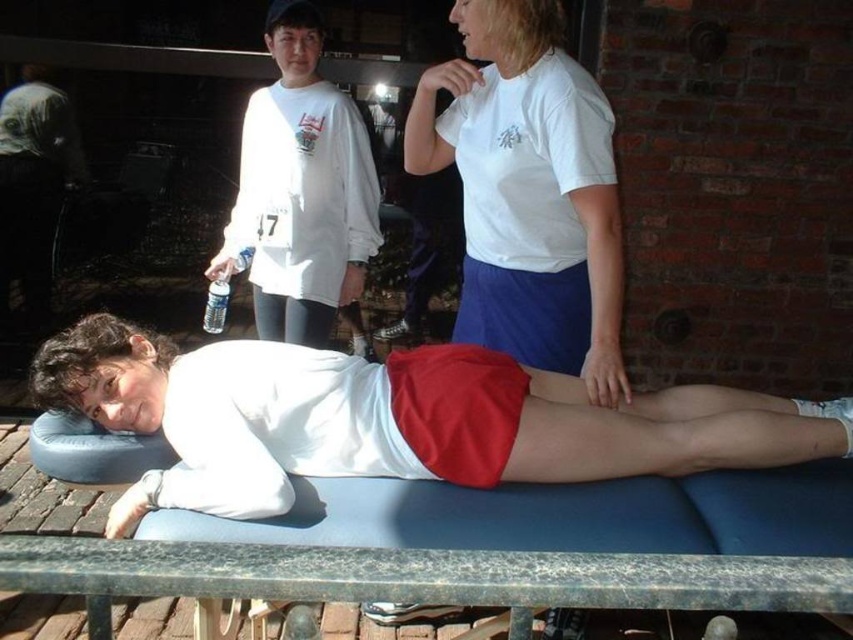
Who is more forward, (286, 477) or (473, 150)?

Point (286, 477) is more forward.

Can you confirm if white matte shirt at center is positioned above white cotton t-shirt at upper center?

No.

Does point (206, 483) lie behind point (485, 131)?

No, (206, 483) is closer to viewer.

Where is `white matte shirt at center`? This screenshot has height=640, width=853. white matte shirt at center is located at coordinates (393, 419).

Measure the distance from white matte shirt at center to white long-sleeved shirt at upper left.

white matte shirt at center and white long-sleeved shirt at upper left are 38.51 inches apart from each other.

Can you confirm if white matte shirt at center is thinner than white long-sleeved shirt at upper left?

In fact, white matte shirt at center might be wider than white long-sleeved shirt at upper left.

At what (x,y) coordinates should I click in order to perform the action: click on white matte shirt at center. Please return your answer as a coordinate pair (x, y). Looking at the image, I should click on (393, 419).

Image resolution: width=853 pixels, height=640 pixels. What are the coordinates of `white matte shirt at center` in the screenshot? It's located at (393, 419).

Is point (309, 600) less distant than point (276, 60)?

Yes, it is.

Does point (740, 608) come behind point (282, 278)?

No, it is not.

I want to click on marbled stone rail at lower center, so click(424, 576).